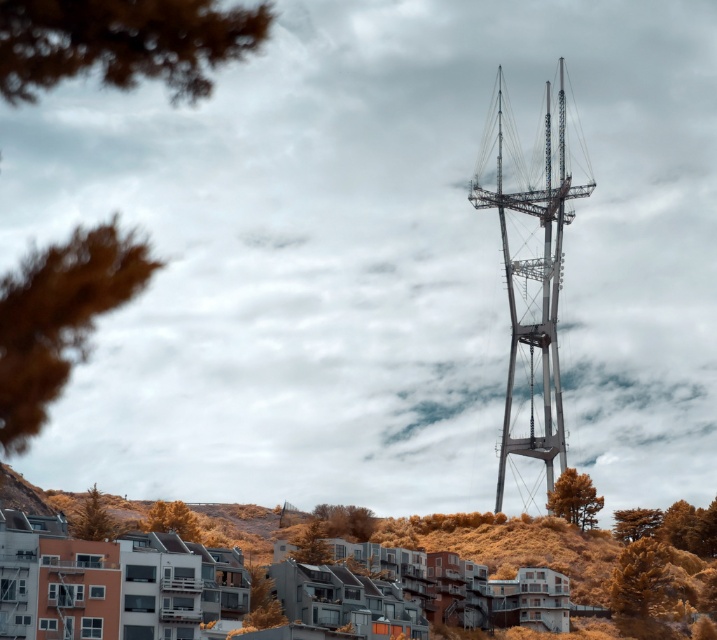
Question: Estimate the real-world distances between objects in this image. Which object is farther from the golden textured pine tree at lower left?

Choices:
 (A) brown fuzzy bush at left
 (B) golden textured hillside at lower center

Answer: (A)

Question: Does golden textured tree at lower left have a larger size compared to green textured tree at lower right?

Choices:
 (A) yes
 (B) no

Answer: (B)

Question: Is brown fuzzy bush at left smaller than green textured tree at lower right?

Choices:
 (A) yes
 (B) no

Answer: (A)

Question: Which point is farther to the camera?

Choices:
 (A) (617, 570)
 (B) (24, 300)

Answer: (A)

Question: Which of the following is the farthest from the observer?

Choices:
 (A) golden textured tree at lower left
 (B) golden textured tree at lower right
 (C) golden textured pine tree at lower left

Answer: (B)

Question: Where is metallic gray tower at center located in relation to green matte tree at lower right in the image?

Choices:
 (A) above
 (B) below

Answer: (A)